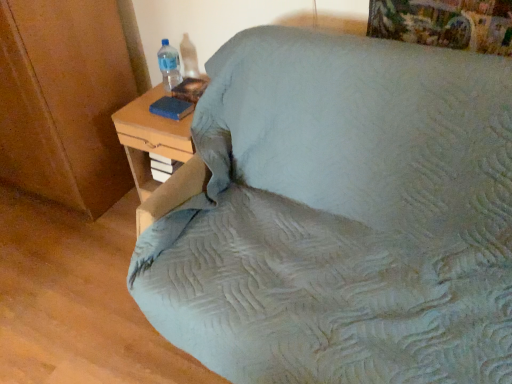
Question: From the image's perspective, is transparent plastic bottle at upper left above or below blue matte book at upper left?

Choices:
 (A) above
 (B) below

Answer: (A)

Question: From their relative heights in the image, would you say transparent plastic bottle at upper left is taller or shorter than blue matte book at upper left?

Choices:
 (A) tall
 (B) short

Answer: (A)

Question: Based on their relative distances, which object is nearer to the light blue fabric bed at center?

Choices:
 (A) transparent plastic bottle at upper left
 (B) blue matte book at upper left
 (C) woodennightstand at right

Answer: (C)

Question: Based on their relative distances, which object is farther from the blue matte book at upper left?

Choices:
 (A) woodennightstand at right
 (B) transparent plastic bottle at upper left
 (C) light blue fabric bed at center

Answer: (C)